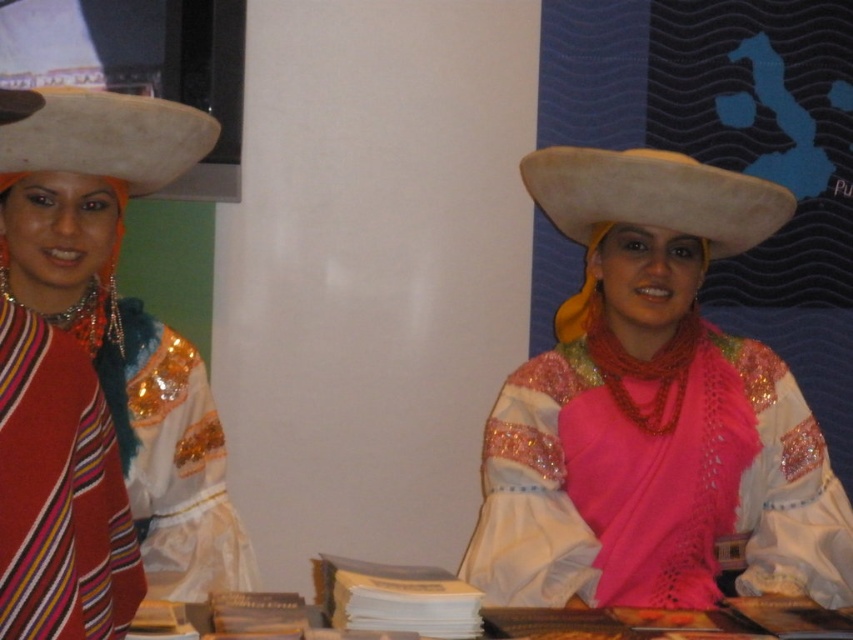
Question: Which object is farther from the camera taking this photo?

Choices:
 (A) matte white hat at center
 (B) white felt cowboy hat at center
 (C) striped wool scarf at left
 (D) white felt hat at left

Answer: (B)

Question: Observing the image, what is the correct spatial positioning of matte white hat at center in reference to matte orange fabric at left?

Choices:
 (A) left
 (B) right

Answer: (B)

Question: Is matte white hat at center wider than white felt hat at left?

Choices:
 (A) yes
 (B) no

Answer: (A)

Question: Which of the following is the closest to the observer?

Choices:
 (A) (779, 216)
 (B) (102, 577)

Answer: (B)

Question: Can you confirm if white felt cowboy hat at center is positioned to the right of white felt hat at left?

Choices:
 (A) yes
 (B) no

Answer: (A)

Question: Among these objects, which one is nearest to the camera?

Choices:
 (A) matte white hat at center
 (B) white felt hat at left
 (C) matte orange fabric at left

Answer: (C)